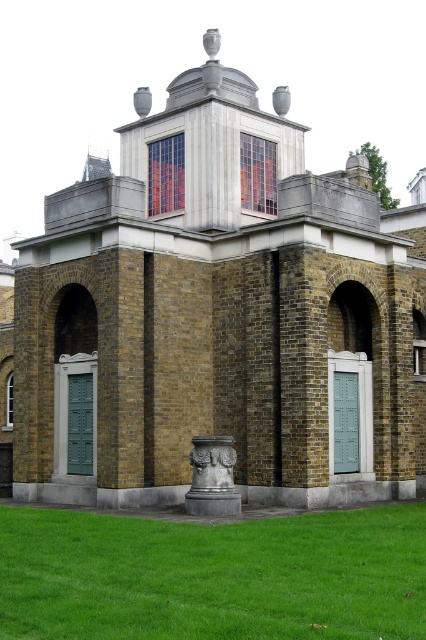
You are standing at the point marked as point (213, 577) in the image. What do you see directly below you?

At point (213, 577) lies green grass at lower center.

You are standing in front of the classical building and want to place a small garden statue on the green grass at lower center. Considering the height of the dark gray stone column at center, will the statue be easily visible from your current position?

The green grass at lower center has a lesser height compared to the dark gray stone column at center, so the statue placed on the green grass at lower center will be easily visible since it is not obstructed by the shorter grass.